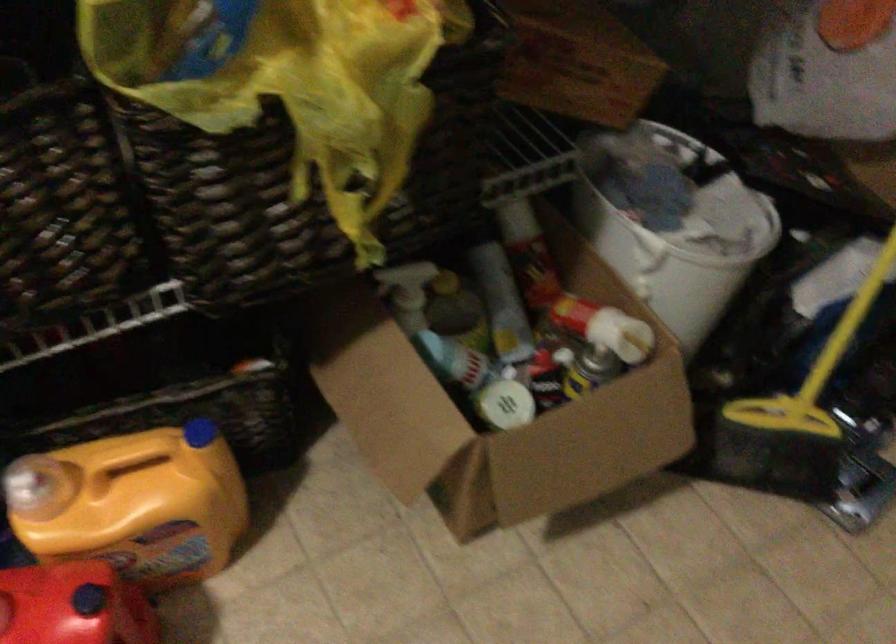
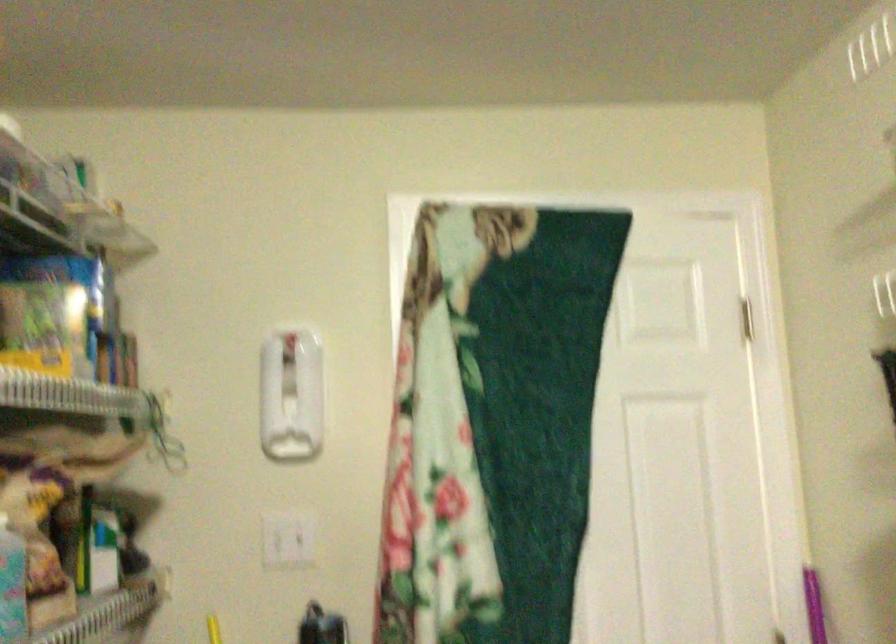
Based on the continuous images, in which direction is the camera rotating?

The rotation direction of the camera is right-up.